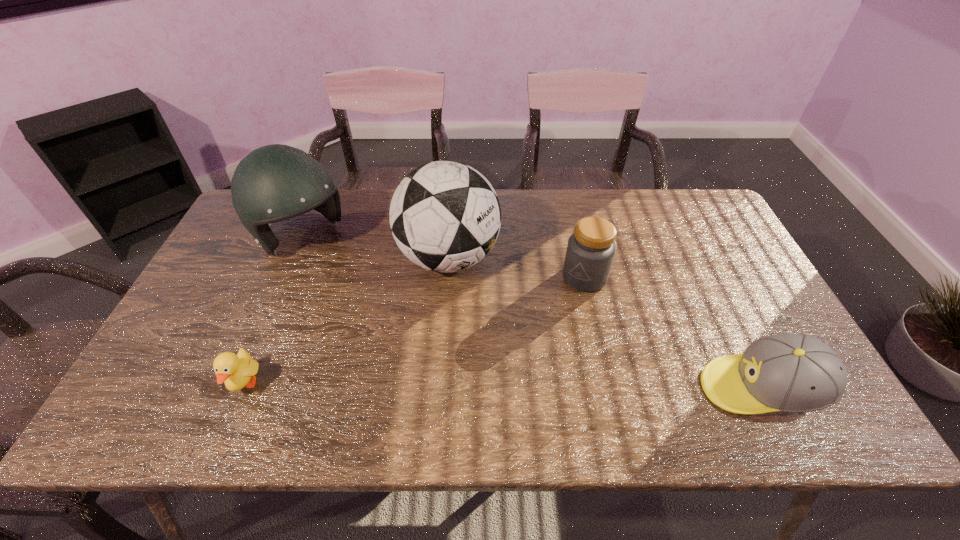
In the image, there is a desktop. At what (x,y) coordinates should I click in order to perform the action: click on vacant space at the right edge. Please return your answer as a coordinate pair (x, y). Looking at the image, I should click on (724, 301).

Where is `vacant region at the far right corner`? vacant region at the far right corner is located at coordinates (681, 224).

Where is `free space between the football helmet and the duckling`? The width and height of the screenshot is (960, 540). free space between the football helmet and the duckling is located at coordinates (273, 310).

The height and width of the screenshot is (540, 960). I want to click on empty space that is in between the second shortest object and the football helmet, so click(x=531, y=313).

This screenshot has width=960, height=540. Find the location of `free spot between the football helmet and the rightmost object`. free spot between the football helmet and the rightmost object is located at coordinates (531, 313).

I want to click on free spot between the soccer ball and the duckling, so click(x=347, y=321).

Identify the location of free space between the second shortest object and the football helmet. (531, 313).

Where is `vacant point located between the shortest object and the soccer ball`? vacant point located between the shortest object and the soccer ball is located at coordinates (347, 321).

Locate an element on the screen. vacant point located between the duckling and the second shortest object is located at coordinates (503, 387).

Locate an element on the screen. blank region between the duckling and the third object from left to right is located at coordinates (347, 321).